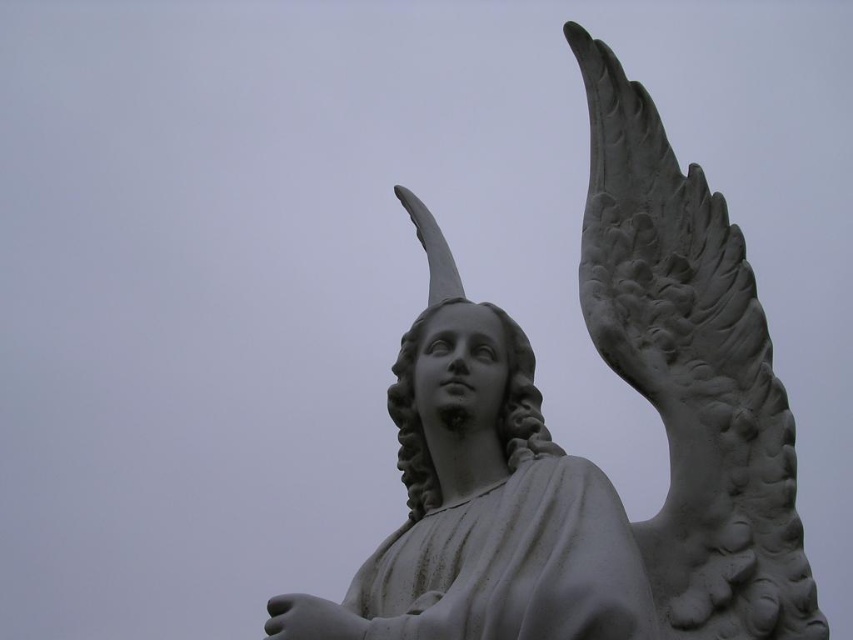
You are an art student analyzing the statue. You notice the white stone wing at upper right and the white stone statue at center. Which object is positioned to the right of the other?

The white stone wing at upper right is to the right of the white stone statue at center.

You are an art conservator examining the statue. You notice a small crack at point [691,372]. Based on the statue description, which part of the statue is affected by the crack?

The small crack at point [691,372] is located at the white stone wing at upper right.